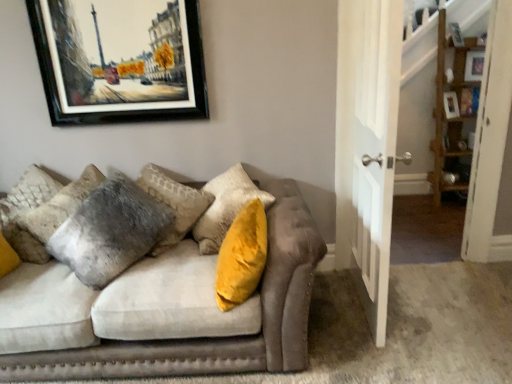
Image resolution: width=512 pixels, height=384 pixels. In order to click on free space between velvet gray couch at center and white wooden door at center in this screenshot , I will do `click(336, 322)`.